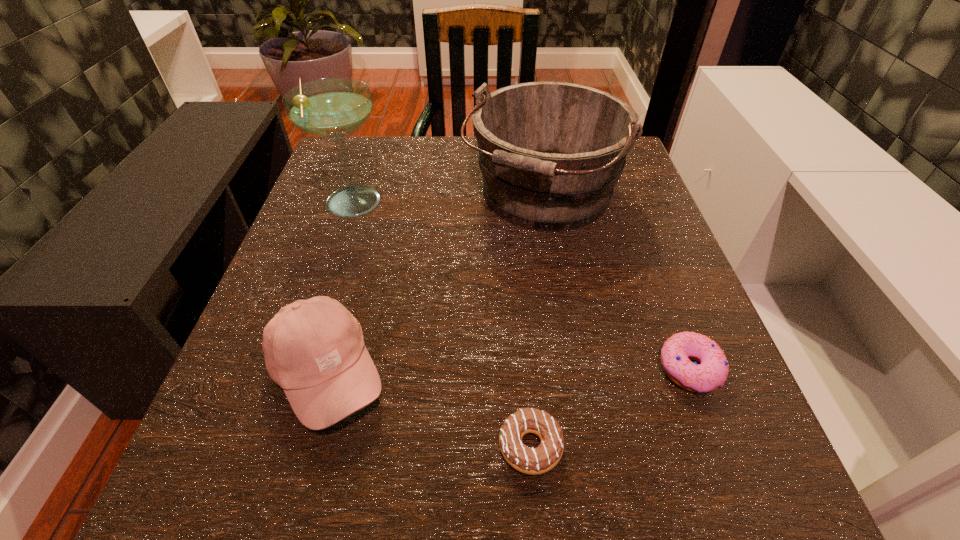
The image size is (960, 540). I want to click on vacant space that's between the baseball cap and the nearer doughnut, so click(x=429, y=409).

Identify the location of vacant area that lies between the left doughnut and the wine bucket. (536, 321).

Locate an element on the screen. vacant area that lies between the baseball cap and the second tallest object is located at coordinates (435, 285).

You are a GUI agent. You are given a task and a screenshot of the screen. Output one action in this format:
    pyautogui.click(x=<x>, y=<y>)
    Task: Click on the vacant space in between the wine bucket and the left doughnut
    This screenshot has width=960, height=540.
    Given the screenshot: What is the action you would take?
    pyautogui.click(x=536, y=321)

I want to click on vacant space in between the tallest object and the nearer doughnut, so click(442, 324).

Where is `empty location between the tallest object and the wine bucket`? This screenshot has width=960, height=540. empty location between the tallest object and the wine bucket is located at coordinates (447, 199).

Image resolution: width=960 pixels, height=540 pixels. What are the coordinates of `free space between the fourth shortest object and the right doughnut` in the screenshot? It's located at (615, 282).

Locate an element on the screen. This screenshot has height=540, width=960. object identified as the closest to the third shortest object is located at coordinates 533,461.

Identify which object is the closest to the fourth shortest object. Please provide its 2D coordinates. Your answer should be formatted as a tuple, i.e. [(x, y)], where the tuple contains the x and y coordinates of a point satisfying the conditions above.

[(332, 108)]

The width and height of the screenshot is (960, 540). Identify the location of vacant position in the image that satisfies the following two spatial constraints: 1. on the front side of the fourth tallest object; 2. on the front-facing side of the baseball cap. (691, 373).